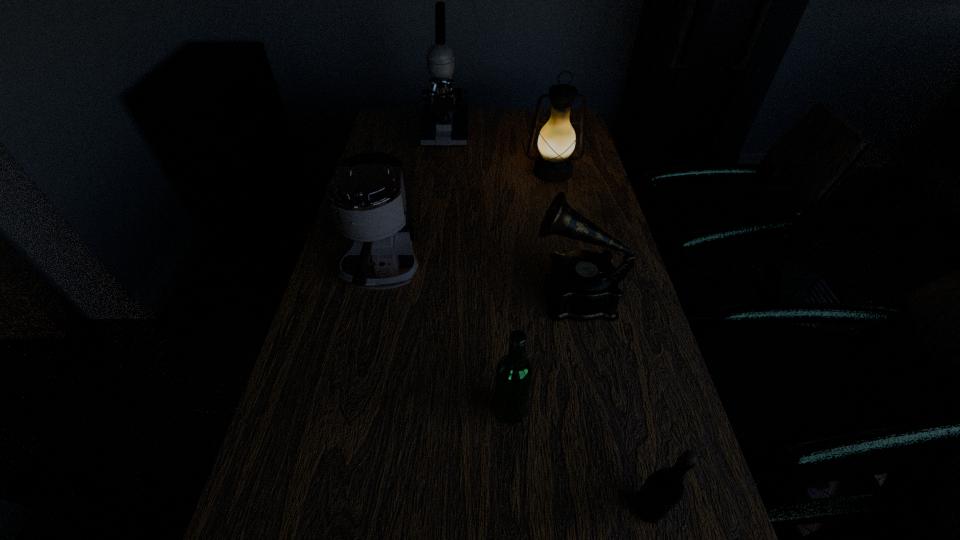
You are a GUI agent. You are given a task and a screenshot of the screen. Output one action in this format:
    pyautogui.click(x=<x>, y=<y>)
    Task: Click on the vacant point located between the farthest object and the coffee maker
    
    Given the screenshot: What is the action you would take?
    pyautogui.click(x=414, y=202)

Where is `vacant area that lies between the fifth nearest object and the coffee maker`? The height and width of the screenshot is (540, 960). vacant area that lies between the fifth nearest object and the coffee maker is located at coordinates (468, 222).

In order to click on empty space between the left beer bottle and the microscope in this screenshot , I will do `click(478, 271)`.

Locate an element on the screen. This screenshot has width=960, height=540. vacant area that lies between the coffee maker and the second farthest object is located at coordinates (468, 222).

Select which object appears as the second closest to the microscope. Please provide its 2D coordinates. Your answer should be formatted as a tuple, i.e. [(x, y)], where the tuple contains the x and y coordinates of a point satisfying the conditions above.

[(366, 195)]

I want to click on the third closest object to the farthest object, so click(x=582, y=285).

Locate an element on the screen. free space that satisfies the following two spatial constraints: 1. on the front side of the left beer bottle; 2. on the right side of the tallest object is located at coordinates (414, 410).

Locate an element on the screen. This screenshot has width=960, height=540. free space in the image that satisfies the following two spatial constraints: 1. on the back side of the nearest object; 2. on the horn of the phonograph record is located at coordinates [x=596, y=295].

Locate an element on the screen. blank area in the image that satisfies the following two spatial constraints: 1. on the horn of the phonograph record; 2. on the right side of the right beer bottle is located at coordinates (621, 508).

This screenshot has height=540, width=960. I want to click on blank area in the image that satisfies the following two spatial constraints: 1. on the front side of the third object from left to right; 2. on the left side of the nearest object, so click(x=516, y=508).